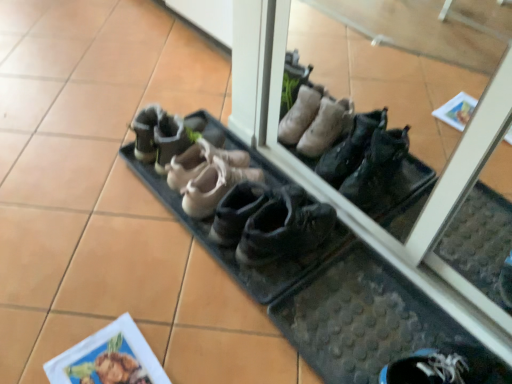
Question: Can you confirm if black rubber boot at center, the 4th footwear when ordered from left to right, is wider than matte paper at lower left?

Choices:
 (A) no
 (B) yes

Answer: (B)

Question: Is black rubber boot at center, the first footwear from the right, far from matte paper at lower left?

Choices:
 (A) yes
 (B) no

Answer: (B)

Question: Can you confirm if black rubber boot at center, the 4th footwear when ordered from left to right, is bigger than matte paper at lower left?

Choices:
 (A) no
 (B) yes

Answer: (B)

Question: Can you confirm if black rubber boot at center, the 4th footwear when ordered from left to right, is taller than matte paper at lower left?

Choices:
 (A) yes
 (B) no

Answer: (A)

Question: From a real-world perspective, is black rubber boot at center, the first footwear from the right, below matte paper at lower left?

Choices:
 (A) yes
 (B) no

Answer: (B)

Question: In terms of width, does brown suede shoes at center, acting as the second footwear starting from the left, look wider or thinner when compared to black rubber boot at center, the 4th footwear when ordered from left to right?

Choices:
 (A) wide
 (B) thin

Answer: (A)

Question: Relative to black rubber boot at center, the 4th footwear when ordered from left to right, is brown suede shoes at center, acting as the second footwear starting from the left, in front or behind?

Choices:
 (A) behind
 (B) front

Answer: (A)

Question: Considering the positions of brown suede shoes at center, acting as the second footwear starting from the left, and black rubber boot at center, the 4th footwear when ordered from left to right, in the image, is brown suede shoes at center, acting as the second footwear starting from the left, bigger or smaller than black rubber boot at center, the 4th footwear when ordered from left to right,?

Choices:
 (A) big
 (B) small

Answer: (A)

Question: Visually, is brown suede shoes at center, marked as the third footwear in a right-to-left arrangement, positioned to the left or to the right of black rubber boot at center, the 4th footwear when ordered from left to right?

Choices:
 (A) right
 (B) left

Answer: (B)

Question: Is leather/soft suede ballet flats at center, positioned as the fourth footwear in right-to-left order, taller or shorter than brown suede shoes at center, acting as the second footwear starting from the left?

Choices:
 (A) short
 (B) tall

Answer: (B)

Question: From a real-world perspective, relative to brown suede shoes at center, marked as the third footwear in a right-to-left arrangement, is leather/soft suede ballet flats at center, positioned as the 1th footwear in left-to-right order, vertically above or below?

Choices:
 (A) above
 (B) below

Answer: (A)

Question: In the image, is leather/soft suede ballet flats at center, positioned as the 1th footwear in left-to-right order, on the left side or the right side of brown suede shoes at center, acting as the second footwear starting from the left?

Choices:
 (A) left
 (B) right

Answer: (A)

Question: Which is correct: leather/soft suede ballet flats at center, positioned as the fourth footwear in right-to-left order, is inside brown suede shoes at center, marked as the third footwear in a right-to-left arrangement, or outside of it?

Choices:
 (A) inside
 (B) outside

Answer: (B)

Question: Does point (218, 175) appear closer or farther from the camera than point (139, 168)?

Choices:
 (A) farther
 (B) closer

Answer: (B)

Question: Visually, is leather shoes at center, the 3th footwear viewed from the left, positioned to the left or to the right of brown suede shoes at center, marked as the third footwear in a right-to-left arrangement?

Choices:
 (A) left
 (B) right

Answer: (B)